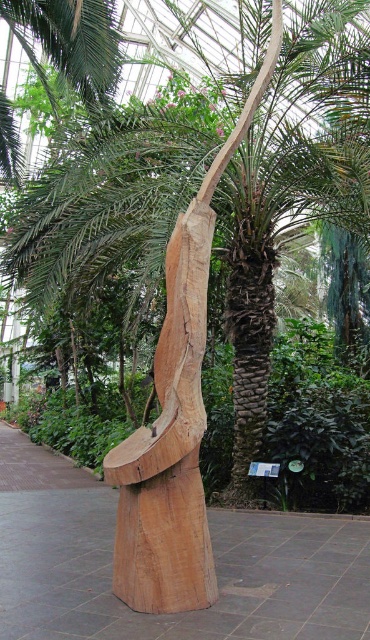
Question: Is natural wood sculpture at center further to the viewer compared to brown rough bark tree trunk at center?

Choices:
 (A) yes
 (B) no

Answer: (B)

Question: Which object appears closest to the camera in this image?

Choices:
 (A) natural wood sculpture at center
 (B) brown rough bark tree trunk at center

Answer: (A)

Question: Can you confirm if natural wood sculpture at center is positioned above brown rough bark tree trunk at center?

Choices:
 (A) yes
 (B) no

Answer: (B)

Question: Is natural wood sculpture at center below brown rough bark tree trunk at center?

Choices:
 (A) yes
 (B) no

Answer: (A)

Question: Which point is closer to the camera?

Choices:
 (A) brown rough bark tree trunk at center
 (B) natural wood sculpture at center

Answer: (B)